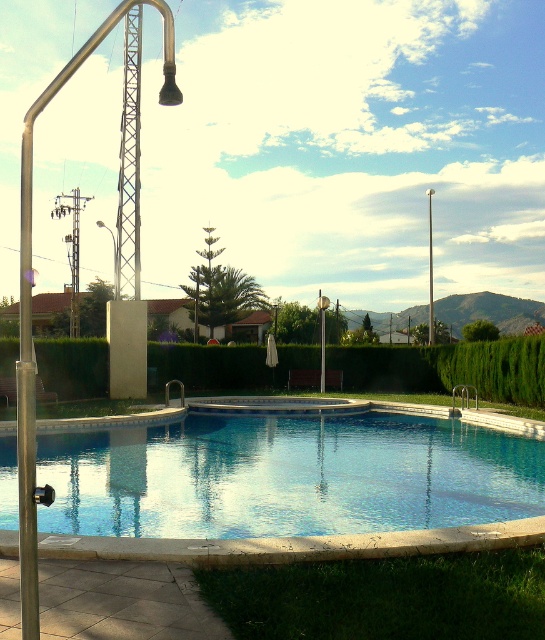
Question: Is transparent glass pool at center above silver metallic pole at left?

Choices:
 (A) yes
 (B) no

Answer: (B)

Question: Which point is closer to the camera taking this photo?

Choices:
 (A) (429, 250)
 (B) (31, 321)
 (C) (329, 438)

Answer: (B)

Question: Does silver metallic pole at left come in front of smooth white pole at upper center?

Choices:
 (A) yes
 (B) no

Answer: (A)

Question: Among these objects, which one is nearest to the camera?

Choices:
 (A) silver metallic pole at left
 (B) transparent glass pool at center
 (C) smooth white pole at upper center

Answer: (A)

Question: Among these objects, which one is farthest from the camera?

Choices:
 (A) transparent glass pool at center
 (B) silver metallic pole at left
 (C) smooth white pole at upper center

Answer: (C)

Question: Is transparent glass pool at center smaller than smooth white pole at upper center?

Choices:
 (A) yes
 (B) no

Answer: (A)